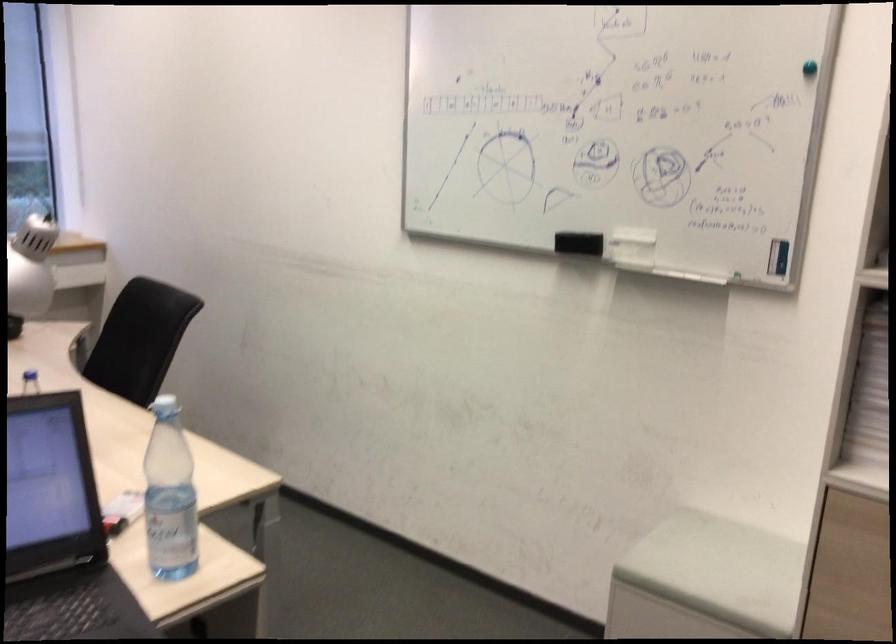
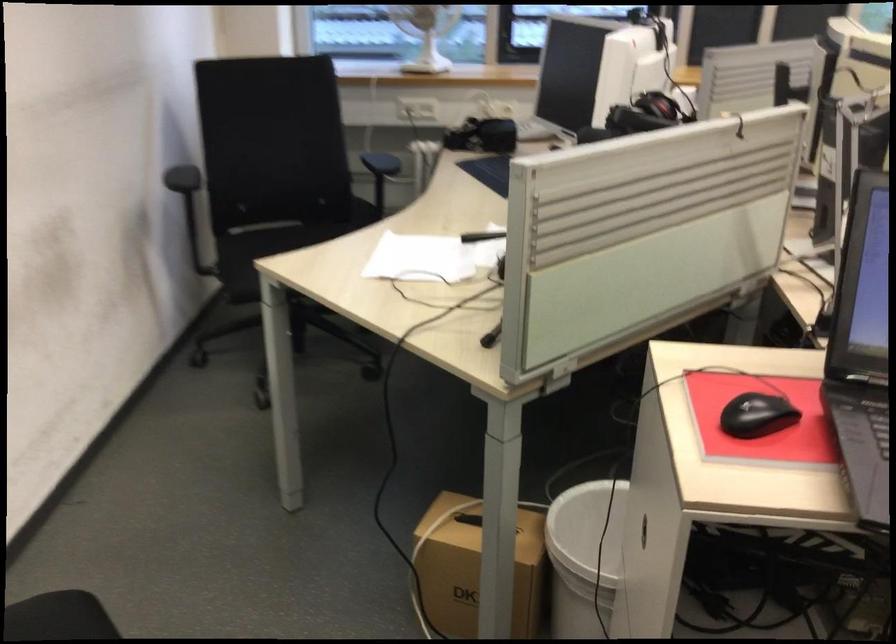
How did the camera likely rotate?

The camera rotated toward left-down.